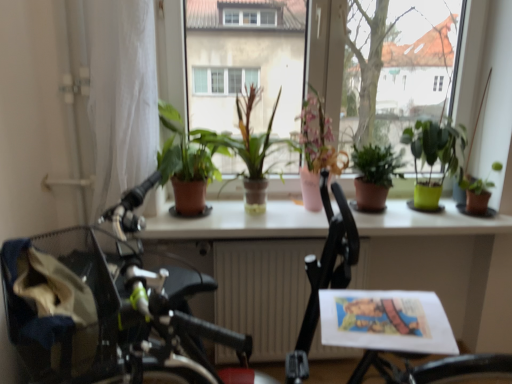
This screenshot has height=384, width=512. Describe the element at coordinates (189, 161) in the screenshot. I see `green matte plant at center, placed as the 1th houseplant when sorted from left to right` at that location.

The image size is (512, 384). What do you see at coordinates (375, 175) in the screenshot? I see `green matte plant at center, marked as the 3th houseplant in a right-to-left arrangement` at bounding box center [375, 175].

Looking at this image, in order to face white glossy table at center, should I rotate leftwards or rightwards?

To face it directly, rotate right by 4.831 degrees.

The image size is (512, 384). What are the coordinates of `white glossy window sill at center` in the screenshot? It's located at (239, 223).

What is the approximate width of green matte plant at center, the second houseplant positioned from the left?

green matte plant at center, the second houseplant positioned from the left, is 13.96 inches in width.

Where is `pink ceramic vase at center, which is counted as the third houseplant, starting from the left`? The width and height of the screenshot is (512, 384). pink ceramic vase at center, which is counted as the third houseplant, starting from the left is located at coordinates (317, 149).

Can you confirm if green matte plant at center, marked as the 3th houseplant in a right-to-left arrangement, is positioned to the left of green matte plant at center, the second houseplant positioned from the left?

Incorrect, green matte plant at center, marked as the 3th houseplant in a right-to-left arrangement, is not on the left side of green matte plant at center, the second houseplant positioned from the left.

Which of these two, green matte plant at center, the fourth houseplant viewed from the left, or green matte plant at center, the second houseplant positioned from the left, is smaller?

green matte plant at center, the fourth houseplant viewed from the left.

From a real-world perspective, is green matte plant at center, marked as the 3th houseplant in a right-to-left arrangement, below green matte plant at center, which is counted as the 5th houseplant, starting from the right?

Yes, from a real-world perspective, green matte plant at center, marked as the 3th houseplant in a right-to-left arrangement, is beneath green matte plant at center, which is counted as the 5th houseplant, starting from the right.

Which is behind, green matte plant at center, the fourth houseplant viewed from the left, or green matte plant at center, the second houseplant positioned from the left?

green matte plant at center, the fourth houseplant viewed from the left, is behind.

Is green matte plant at center, placed as the 1th houseplant when sorted from left to right, thinner than pink ceramic vase at center, which is counted as the third houseplant, starting from the left?

No, green matte plant at center, placed as the 1th houseplant when sorted from left to right, is not thinner than pink ceramic vase at center, which is counted as the third houseplant, starting from the left.

Can you see green matte plant at center, the sixth houseplant positioned from the right, touching pink ceramic vase at center, which is counted as the third houseplant, starting from the left?

No, green matte plant at center, the sixth houseplant positioned from the right, is not next to pink ceramic vase at center, which is counted as the third houseplant, starting from the left.

Could you tell me if green matte plant at center, the sixth houseplant positioned from the right, is turned towards pink ceramic vase at center, which is counted as the 4th houseplant, starting from the right?

No.

From the image's perspective, would you say green matte plant at center, the sixth houseplant positioned from the right, is shown under pink ceramic vase at center, which is counted as the third houseplant, starting from the left?

Correct, green matte plant at center, the sixth houseplant positioned from the right, appears lower than pink ceramic vase at center, which is counted as the third houseplant, starting from the left, in the image.

Based on the photo, is white glossy table at center inside green plastic pot at right, the 2th houseplant positioned from the right?

No, green plastic pot at right, the 2th houseplant positioned from the right, does not contain white glossy table at center.

From a real-world perspective, is green plastic pot at right, the 2th houseplant positioned from the right, over white glossy table at center?

Yes, from a real-world perspective, green plastic pot at right, the 2th houseplant positioned from the right, is on top of white glossy table at center.

Considering the positions of objects green plastic pot at right, the 2th houseplant positioned from the right, and white glossy table at center in the image provided, who is more to the left, green plastic pot at right, the 2th houseplant positioned from the right, or white glossy table at center?

white glossy table at center.

Looking at this image, between green matte plant at right, the 1th houseplant positioned from the right, and green matte plant at center, the sixth houseplant positioned from the right, which one has more height?

With more height is green matte plant at center, the sixth houseplant positioned from the right.

Is green matte plant at right, which is the 6th houseplant in left-to-right order, not inside green matte plant at center, the sixth houseplant positioned from the right?

Yes, green matte plant at right, which is the 6th houseplant in left-to-right order, is located beyond the bounds of green matte plant at center, the sixth houseplant positioned from the right.

Can you confirm if green matte plant at right, which is the 6th houseplant in left-to-right order, is wider than green matte plant at center, placed as the 1th houseplant when sorted from left to right?

In fact, green matte plant at right, which is the 6th houseplant in left-to-right order, might be narrower than green matte plant at center, placed as the 1th houseplant when sorted from left to right.

Considering the positions of objects green matte plant at right, the 1th houseplant positioned from the right, and green matte plant at center, placed as the 1th houseplant when sorted from left to right, in the image provided, who is more to the left, green matte plant at right, the 1th houseplant positioned from the right, or green matte plant at center, placed as the 1th houseplant when sorted from left to right,?

green matte plant at center, placed as the 1th houseplant when sorted from left to right, is more to the left.

From a real-world perspective, is green plastic pot at right, the fifth houseplant positioned from the left, physically located above or below green matte plant at center, the sixth houseplant positioned from the right?

green plastic pot at right, the fifth houseplant positioned from the left, is situated lower than green matte plant at center, the sixth houseplant positioned from the right, in the real world.

Could you tell me if green plastic pot at right, the fifth houseplant positioned from the left, is facing green matte plant at center, placed as the 1th houseplant when sorted from left to right?

No, green plastic pot at right, the fifth houseplant positioned from the left, does not turn towards green matte plant at center, placed as the 1th houseplant when sorted from left to right.

In the scene shown: From the image's perspective, is green plastic pot at right, the 2th houseplant positioned from the right, located beneath green matte plant at center, the sixth houseplant positioned from the right?

A: Yes, from the image's perspective, green plastic pot at right, the 2th houseplant positioned from the right, is beneath green matte plant at center, the sixth houseplant positioned from the right.

From their relative heights in the image, would you say green plastic pot at right, the fifth houseplant positioned from the left, is taller or shorter than green matte plant at center, placed as the 1th houseplant when sorted from left to right?

Clearly, green plastic pot at right, the fifth houseplant positioned from the left, is shorter compared to green matte plant at center, placed as the 1th houseplant when sorted from left to right.

How distant is pink ceramic vase at center, which is counted as the 4th houseplant, starting from the right, from green matte plant at center, the second houseplant positioned from the left?

pink ceramic vase at center, which is counted as the 4th houseplant, starting from the right, and green matte plant at center, the second houseplant positioned from the left, are 17.23 centimeters apart from each other.

From a real-world perspective, who is located lower, pink ceramic vase at center, which is counted as the third houseplant, starting from the left, or green matte plant at center, the second houseplant positioned from the left?

green matte plant at center, the second houseplant positioned from the left, from a real-world perspective.

Is pink ceramic vase at center, which is counted as the 4th houseplant, starting from the right, next to green matte plant at center, which is counted as the 5th houseplant, starting from the right, and touching it?

No, pink ceramic vase at center, which is counted as the 4th houseplant, starting from the right, is not making contact with green matte plant at center, which is counted as the 5th houseplant, starting from the right.

Is pink ceramic vase at center, which is counted as the 4th houseplant, starting from the right, at the left side of green matte plant at center, the second houseplant positioned from the left?

No.

How much distance is there between green plastic pot at right, the 2th houseplant positioned from the right, and white glossy window sill at center?

green plastic pot at right, the 2th houseplant positioned from the right, and white glossy window sill at center are 13.37 inches apart from each other.

Which is behind, point (440, 187) or point (409, 233)?

The point (440, 187) is behind.

Consider the image. Between green plastic pot at right, the fifth houseplant positioned from the left, and white glossy window sill at center, which one appears on the left side from the viewer's perspective?

Positioned to the left is white glossy window sill at center.

This screenshot has width=512, height=384. In order to click on houseplant that is the 2nd one when counting backward from the green matte plant at center, the second houseplant positioned from the left in this screenshot , I will do `click(375, 175)`.

From a real-world perspective, starting from the green matte plant at center, the sixth houseplant positioned from the right, which houseplant is the 2nd one vertically above it? Please provide its 2D coordinates.

[(317, 149)]

Based on the photo, which object lies further to the anchor point green matte plant at center, which is counted as the 5th houseplant, starting from the right, white glossy window sill at center or white glossy table at center?

Among the two, white glossy table at center is located further to green matte plant at center, which is counted as the 5th houseplant, starting from the right.

Estimate the real-world distances between objects in this image. Which object is closer to white glossy window sill at center, green matte plant at center, the fourth houseplant viewed from the left, or pink ceramic vase at center, which is counted as the third houseplant, starting from the left?

Based on the image, green matte plant at center, the fourth houseplant viewed from the left, appears to be nearer to white glossy window sill at center.

Estimate the real-world distances between objects in this image. Which object is further from white glossy table at center, white glossy window sill at center or green plastic pot at right, the fifth houseplant positioned from the left?

Among the two, green plastic pot at right, the fifth houseplant positioned from the left, is located further to white glossy table at center.

Estimate the real-world distances between objects in this image. Which object is closer to white glossy window sill at center, green matte plant at center, the fourth houseplant viewed from the left, or white glossy table at center?

Based on the image, white glossy table at center appears to be nearer to white glossy window sill at center.

Based on their spatial positions, is green plastic pot at right, the fifth houseplant positioned from the left, or green matte plant at center, which is counted as the 5th houseplant, starting from the right, further from green matte plant at center, placed as the 1th houseplant when sorted from left to right?

green plastic pot at right, the fifth houseplant positioned from the left, is positioned further to the anchor green matte plant at center, placed as the 1th houseplant when sorted from left to right.

Which object lies nearer to the anchor point green matte plant at center, marked as the 3th houseplant in a right-to-left arrangement, green matte plant at center, the second houseplant positioned from the left, or green matte plant at right, which is the 6th houseplant in left-to-right order?

The object closer to green matte plant at center, marked as the 3th houseplant in a right-to-left arrangement, is green matte plant at right, which is the 6th houseplant in left-to-right order.

When comparing their distances from green matte plant at right, which is the 6th houseplant in left-to-right order, does white glossy table at center or white glossy window sill at center seem closer?

white glossy window sill at center lies closer to green matte plant at right, which is the 6th houseplant in left-to-right order, than the other object.

Based on their spatial positions, is green plastic pot at right, the 2th houseplant positioned from the right, or green matte plant at center, the fourth houseplant viewed from the left, closer to pink ceramic vase at center, which is counted as the third houseplant, starting from the left?

green matte plant at center, the fourth houseplant viewed from the left, is closer to pink ceramic vase at center, which is counted as the third houseplant, starting from the left.

Where is `houseplant situated between white glossy window sill at center and green plastic pot at right, the fifth houseplant positioned from the left, from left to right`? houseplant situated between white glossy window sill at center and green plastic pot at right, the fifth houseplant positioned from the left, from left to right is located at coordinates (375, 175).

Identify the location of window sill between green matte plant at center, placed as the 1th houseplant when sorted from left to right, and green matte plant at right, which is the 6th houseplant in left-to-right order, from left to right. (239, 223).

In order to click on houseplant between green matte plant at center, the sixth houseplant positioned from the right, and pink ceramic vase at center, which is counted as the 4th houseplant, starting from the right in this screenshot , I will do `click(254, 150)`.

At what (x,y) coordinates should I click in order to perform the action: click on window sill between pink ceramic vase at center, which is counted as the 4th houseplant, starting from the right, and green matte plant at right, which is the 6th houseplant in left-to-right order, from left to right. Please return your answer as a coordinate pair (x, y). This screenshot has width=512, height=384. Looking at the image, I should click on (239, 223).